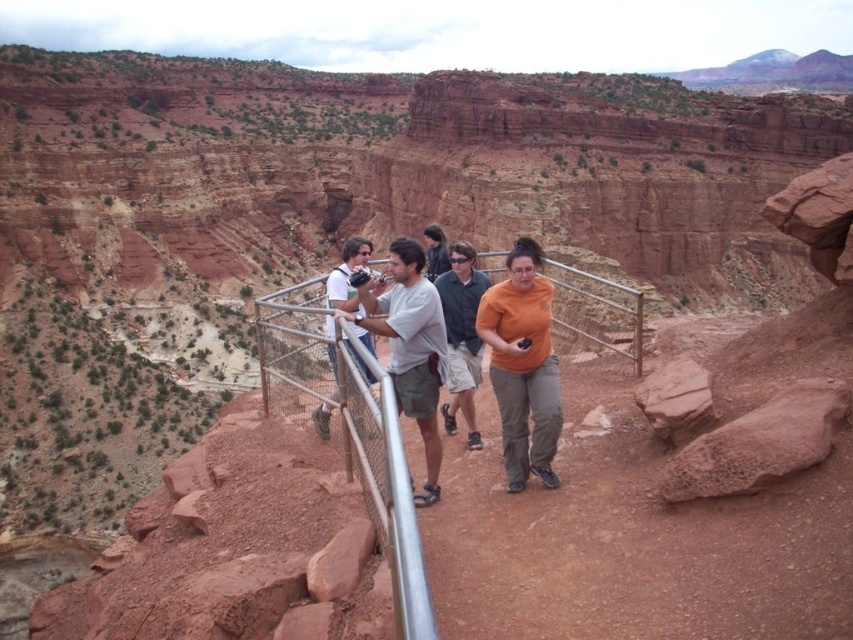
Question: Can you confirm if orange matte shirt at center is positioned below dark gray jacket at center?

Choices:
 (A) no
 (B) yes

Answer: (B)

Question: Which point appears farthest from the camera in this image?

Choices:
 (A) (532, 428)
 (B) (432, 276)
 (C) (450, 291)

Answer: (B)

Question: Can you confirm if silver metallic rail at center is wider than matte white shirt at center?

Choices:
 (A) no
 (B) yes

Answer: (B)

Question: Which object appears farthest from the camera in this image?

Choices:
 (A) orange matte shirt at center
 (B) dark gray jacket at center
 (C) silver metallic rail at center
 (D) matte white shirt at center

Answer: (B)

Question: Is orange cotton shirt at center below dark gray jacket at center?

Choices:
 (A) yes
 (B) no

Answer: (A)

Question: Which point appears closest to the camera in this image?

Choices:
 (A) 300,368
 (B) 440,314

Answer: (B)